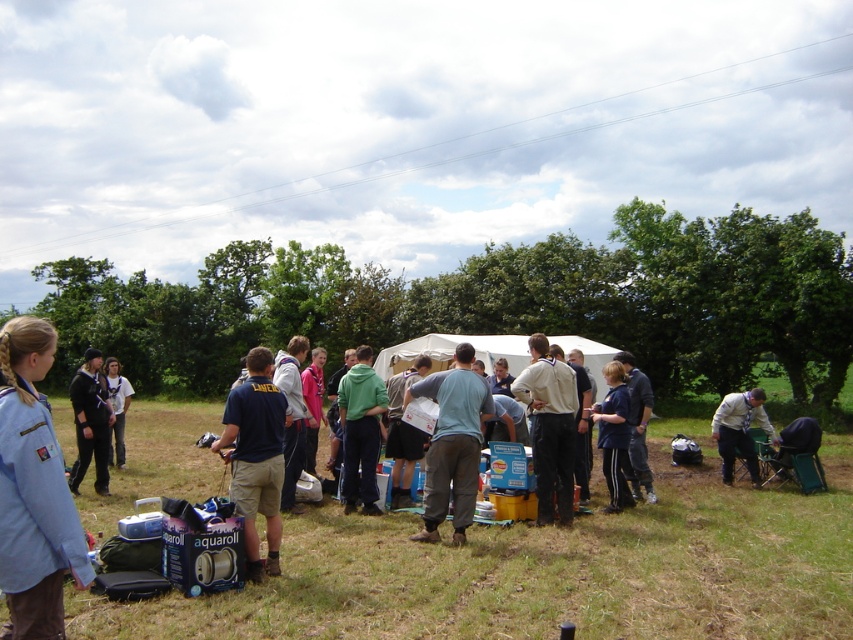
Question: Which point is closer to the camera?

Choices:
 (A) white cotton shirt at center
 (B) green fabric backpack at center
 (C) green matte hoodie at center

Answer: (A)

Question: Which of the following is the farthest from the observer?

Choices:
 (A) navy blue shirt at center
 (B) light blue shirt at lower right
 (C) pink fabric jacket at center
 (D) light blue cotton shirt at center

Answer: (C)

Question: Is green fabric backpack at center thinner than light blue denim jacket at center?

Choices:
 (A) yes
 (B) no

Answer: (B)

Question: Is light blue cotton shirt at center wider than light blue shirt at left?

Choices:
 (A) yes
 (B) no

Answer: (B)

Question: Which point is farther to the camera?

Choices:
 (A) light blue shirt at left
 (B) green matte hoodie at center
 (C) navy blue shirt at center

Answer: (A)

Question: Can you confirm if black uniform at center is smaller than light gray hoodie at center?

Choices:
 (A) yes
 (B) no

Answer: (B)